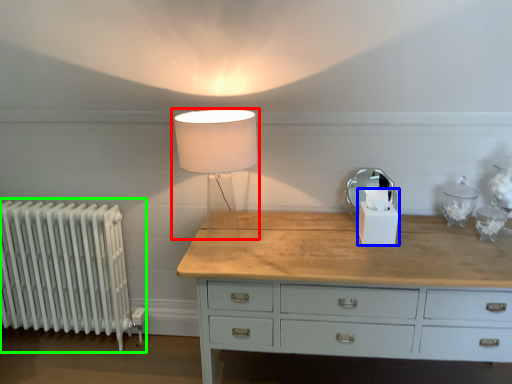
Question: Which is farther away from lamp (highlighted by a red box)? candle holder (highlighted by a blue box) or radiator (highlighted by a green box)?

Choices:
 (A) candle holder
 (B) radiator

Answer: (B)